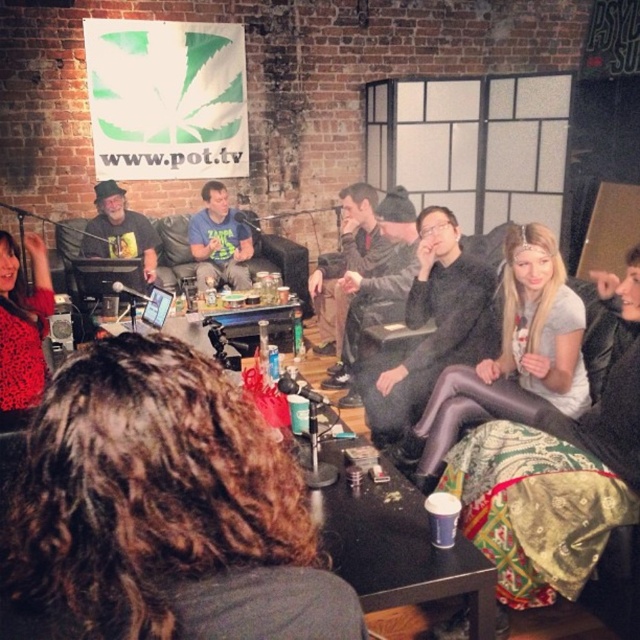
Question: Among these objects, which one is farthest from the camera?

Choices:
 (A) brown curly hair at center
 (B) satin purple leggings at center
 (C) dark gray knit hat at center

Answer: (C)

Question: In this image, where is brown curly hair at center located relative to woodenmaterial/texturetable at center?

Choices:
 (A) below
 (B) above

Answer: (A)

Question: Estimate the real-world distances between objects in this image. Which object is farther from the dark gray knit hat at center?

Choices:
 (A) woodenmaterial/texturetable at center
 (B) brown curly hair at center
 (C) matte black shirt at center

Answer: (B)

Question: Where is matte black laptop at center located in relation to satin purple leggings at center in the image?

Choices:
 (A) below
 (B) above

Answer: (A)

Question: Which point appears closest to the camera in this image?

Choices:
 (A) (118, 284)
 (B) (481, 355)
 (C) (32, 557)

Answer: (C)

Question: Does matte black laptop at center appear over dark gray knit hat at center?

Choices:
 (A) no
 (B) yes

Answer: (A)